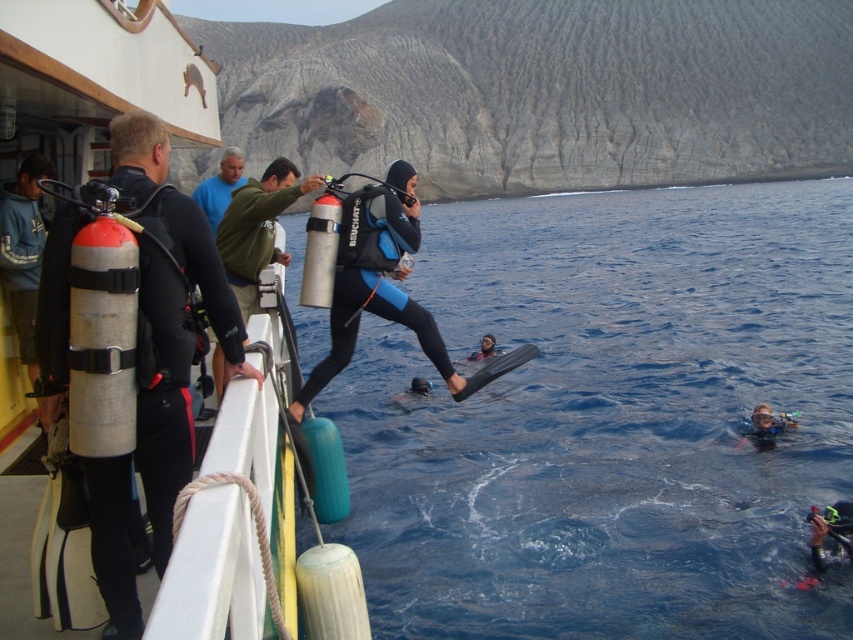
Between blue water at center and black matte wetsuit at center, which one has more height?

blue water at center

Does blue water at center have a lesser width compared to black matte wetsuit at center?

No.

In order to click on blue water at center in this screenshot , I will do [x=608, y=419].

Does white matte boat at center appear on the right side of blue matte wetsuit at center?

In fact, white matte boat at center is to the left of blue matte wetsuit at center.

From the picture: Is white matte boat at center behind blue matte wetsuit at center?

No, white matte boat at center is closer to the viewer.

Which is behind, point (74, 88) or point (479, 348)?

The point (479, 348) is more distant.

Locate an element on the screen. white matte boat at center is located at coordinates (96, 80).

Is white matte boat at center shorter than black matte wetsuit at center?

In fact, white matte boat at center may be taller than black matte wetsuit at center.

Does point (7, 156) come farther from viewer compared to point (358, 193)?

No, (7, 156) is closer to viewer.

Where is `white matte boat at center`? This screenshot has height=640, width=853. white matte boat at center is located at coordinates coord(96,80).